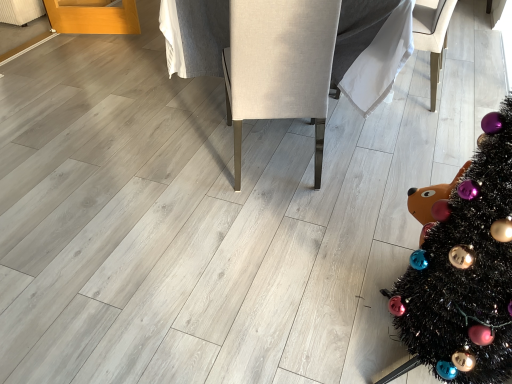
Find the location of `vacant space that is in between beige fabric armchair at center, the 2th armchair viewed from the right, and black tinsel christmas tree at lower right`. vacant space that is in between beige fabric armchair at center, the 2th armchair viewed from the right, and black tinsel christmas tree at lower right is located at coordinates (x=329, y=245).